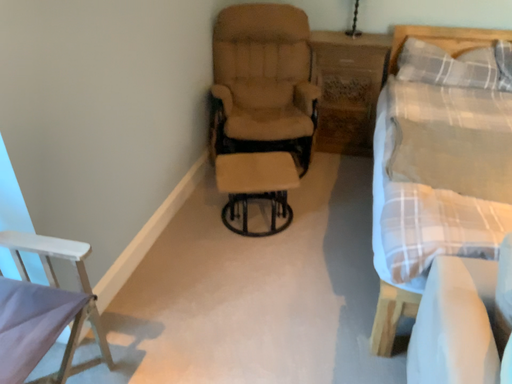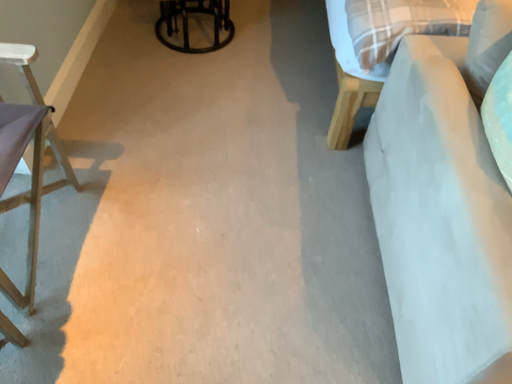
Question: How did the camera likely rotate when shooting the video?

Choices:
 (A) rotated upward
 (B) rotated downward

Answer: (B)